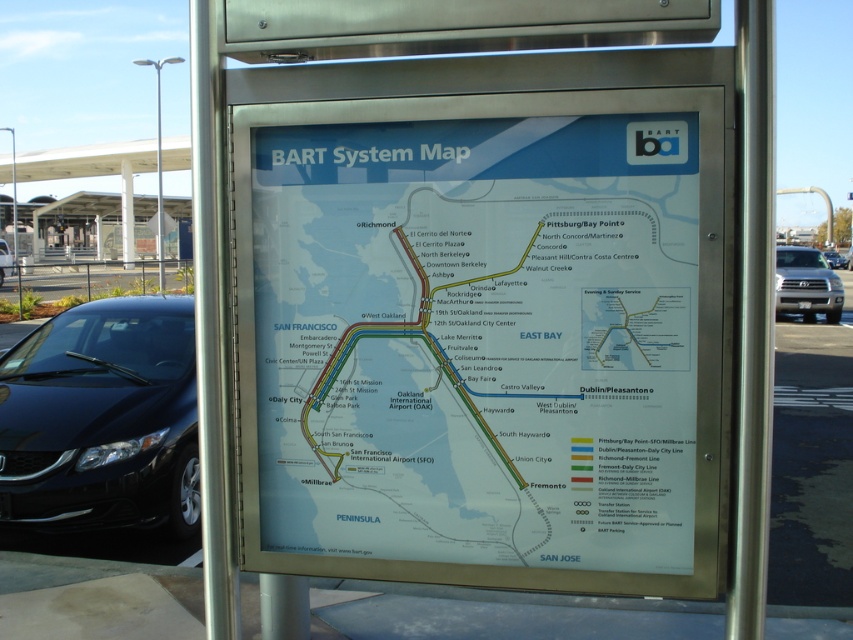
You are a BART station attendant and need to direct a tall delivery truck to park in the designated area. The silver metallic truck at right is near the map. Can it fit under the height restriction sign that the shiny black sedan at left can barely pass under?

The silver metallic truck at right is not as tall as the shiny black sedan at left, so it should be able to fit under the height restriction sign that the shiny black sedan at left can barely pass under.

You are a delivery person standing next to the silver metallic truck at right. You need to take a photo of the BART system map mounted on a metallic frame. Is the camera within your reach to take the photo?

The silver metallic truck at right and camera are 19.98 meters apart. Since the distance is over 19 meters, the camera is too far away to reach, so you cannot take the photo.